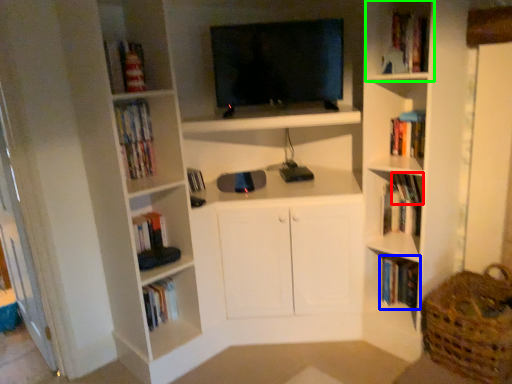
Question: Based on their relative distances, which object is nearer to book (highlighted by a red box)? Choose from book (highlighted by a blue box) and cabinet (highlighted by a green box).

Choices:
 (A) book
 (B) cabinet

Answer: (A)